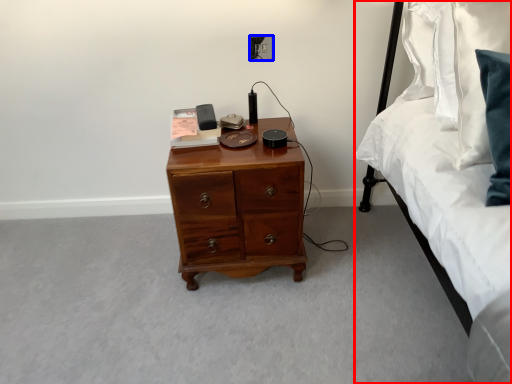
Question: Among these objects, which one is nearest to the camera, bed (highlighted by a red box) or electric outlet (highlighted by a blue box)?

Choices:
 (A) bed
 (B) electric outlet

Answer: (A)